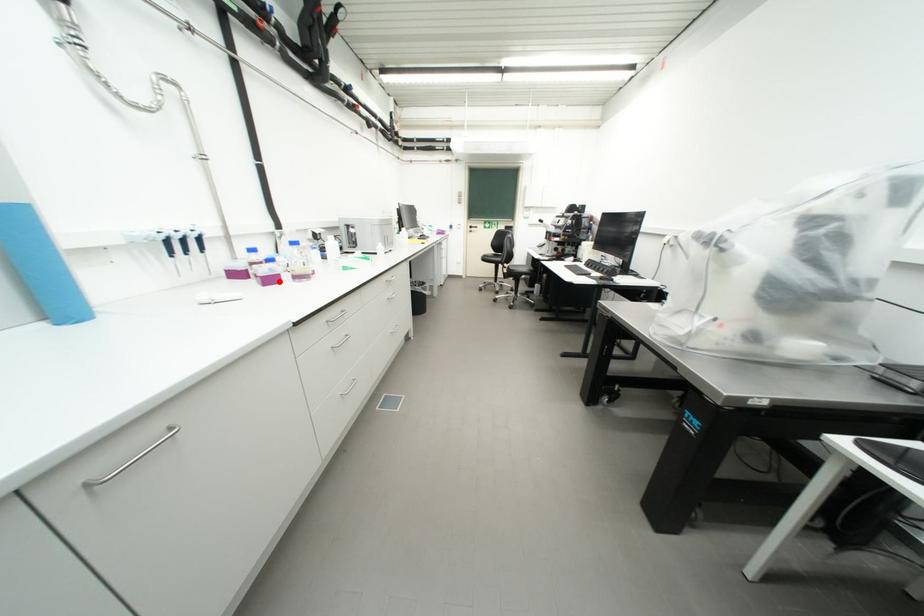
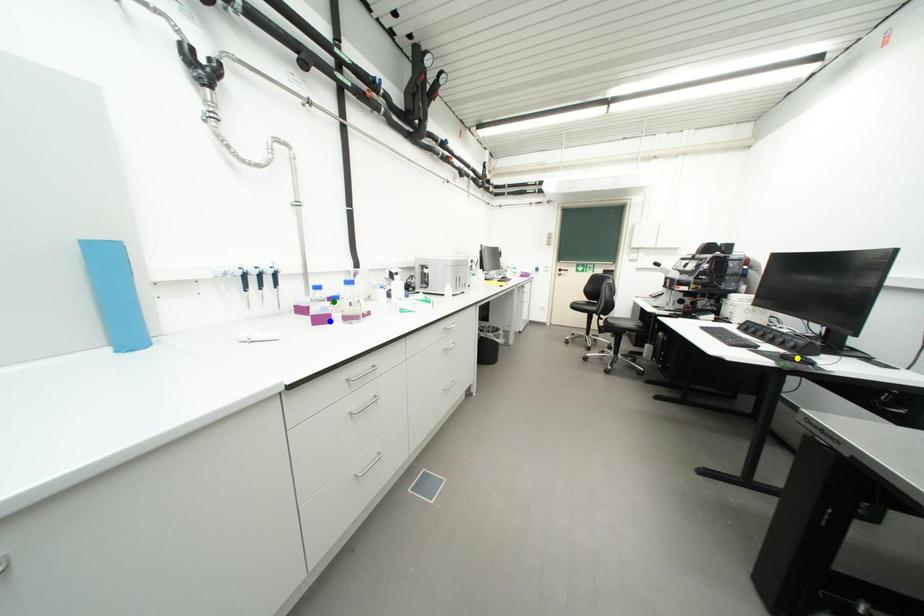
Question: I am providing you with two images of the same scene from different viewpoints. A red point is marked on the first image. You are given multiple points on the second image. Which point in image 2 is actually the same real-world point as the red point in image 1?

Choices:
 (A) green point
 (B) blue point
 (C) yellow point

Answer: (B)